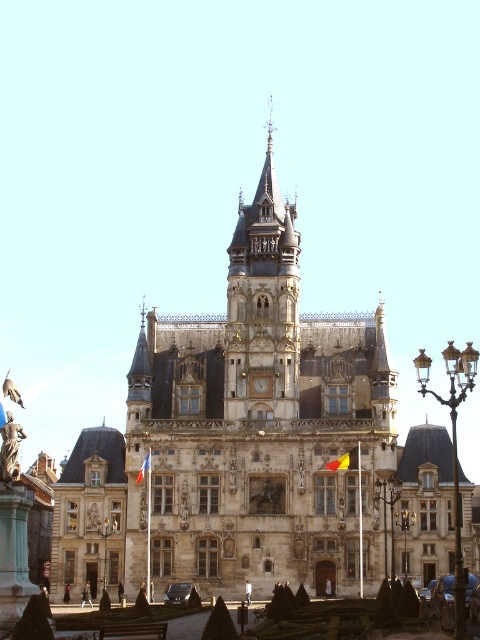
You are standing in front of the grand historic building and want to take a photo that includes both the stone castle at center and the stone clock tower at center. Which one should you focus on first to ensure both are in frame?

You should focus on the stone castle at center first since it is closer to the viewer than the stone clock tower at center, ensuring both are in frame by adjusting the camera angle accordingly.

You are standing in front of the historic building and notice two points marked on its facade. The first point is at coordinates point (287,381) and the second is at point (274,273). Which of these two points is closer to your current position?

Point (287,381) is closer to the camera than point (274,273), so the first point is closer to your current position.

You are a tourist standing in front of the historic building. You notice the stone clock tower at center and the yellow fabric flag at center. Which object is positioned higher relative to the other?

The stone clock tower at center is located above the yellow fabric flag at center, so it is positioned higher.